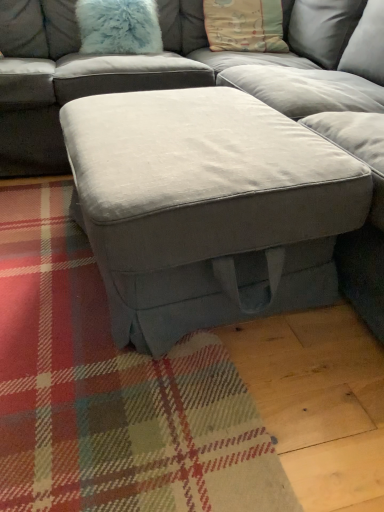
What do you see at coordinates (119, 27) in the screenshot?
I see `fuzzy light blue pillow at upper left, which ranks as the second pillow in right-to-left order` at bounding box center [119, 27].

Describe the element at coordinates (245, 25) in the screenshot. The height and width of the screenshot is (512, 384). I see `pastel cotton pillow at upper center, arranged as the first pillow when viewed from the right` at that location.

Where is `suede gray ottoman at center`? suede gray ottoman at center is located at coordinates (205, 158).

The image size is (384, 512). What are the coordinates of `fuzzy light blue pillow at upper left, which ranks as the second pillow in right-to-left order` in the screenshot? It's located at (119, 27).

Image resolution: width=384 pixels, height=512 pixels. Identify the location of the 2nd pillow directly above the suede gray ottoman at center (from a real-world perspective). (119, 27).

Is fuzzy light blue pillow at upper left, which ranks as the second pillow in right-to-left order, facing towards suede gray ottoman at center?

Yes, fuzzy light blue pillow at upper left, which ranks as the second pillow in right-to-left order, is oriented towards suede gray ottoman at center.

Is fuzzy light blue pillow at upper left, which ranks as the second pillow in right-to-left order, wider than suede gray ottoman at center?

No.

Is pastel cotton pillow at upper center, the second pillow in the left-to-right sequence, aimed at suede gray ottoman at center?

Yes, pastel cotton pillow at upper center, the second pillow in the left-to-right sequence, faces towards suede gray ottoman at center.

Looking at this image, which of these two, pastel cotton pillow at upper center, the second pillow in the left-to-right sequence, or suede gray ottoman at center, is thinner?

Thinner between the two is pastel cotton pillow at upper center, the second pillow in the left-to-right sequence.

Between pastel cotton pillow at upper center, the second pillow in the left-to-right sequence, and suede gray ottoman at center, which one is positioned in front?

Positioned in front is suede gray ottoman at center.

From the image's perspective, which one is positioned lower, pastel cotton pillow at upper center, the second pillow in the left-to-right sequence, or suede gray ottoman at center?

suede gray ottoman at center is shown below in the image.

Is suede gray ottoman at center not inside pastel cotton pillow at upper center, the second pillow in the left-to-right sequence?

suede gray ottoman at center lies outside pastel cotton pillow at upper center, the second pillow in the left-to-right sequence,'s area.

Is suede gray ottoman at center to the left of pastel cotton pillow at upper center, the second pillow in the left-to-right sequence, from the viewer's perspective?

Correct, you'll find suede gray ottoman at center to the left of pastel cotton pillow at upper center, the second pillow in the left-to-right sequence.

Would you say suede gray ottoman at center is a long distance from pastel cotton pillow at upper center, arranged as the first pillow when viewed from the right?

No, suede gray ottoman at center is not far away from pastel cotton pillow at upper center, arranged as the first pillow when viewed from the right.

Are pastel cotton pillow at upper center, arranged as the first pillow when viewed from the right, and fuzzy light blue pillow at upper left, the first pillow viewed from the left, located far from each other?

No, there isn't a large distance between pastel cotton pillow at upper center, arranged as the first pillow when viewed from the right, and fuzzy light blue pillow at upper left, the first pillow viewed from the left.

The image size is (384, 512). What are the coordinates of `pillow behind the fuzzy light blue pillow at upper left, the first pillow viewed from the left` in the screenshot? It's located at (245, 25).

Can you confirm if pastel cotton pillow at upper center, arranged as the first pillow when viewed from the right, is thinner than fuzzy light blue pillow at upper left, which ranks as the second pillow in right-to-left order?

No, pastel cotton pillow at upper center, arranged as the first pillow when viewed from the right, is not thinner than fuzzy light blue pillow at upper left, which ranks as the second pillow in right-to-left order.

Considering the relative sizes of pastel cotton pillow at upper center, the second pillow in the left-to-right sequence, and fuzzy light blue pillow at upper left, which ranks as the second pillow in right-to-left order, in the image provided, is pastel cotton pillow at upper center, the second pillow in the left-to-right sequence, bigger than fuzzy light blue pillow at upper left, which ranks as the second pillow in right-to-left order,?

Correct, pastel cotton pillow at upper center, the second pillow in the left-to-right sequence, is larger in size than fuzzy light blue pillow at upper left, which ranks as the second pillow in right-to-left order.

Which is more to the left, suede gray ottoman at center or fuzzy light blue pillow at upper left, the first pillow viewed from the left?

fuzzy light blue pillow at upper left, the first pillow viewed from the left, is more to the left.

How distant is suede gray ottoman at center from fuzzy light blue pillow at upper left, which ranks as the second pillow in right-to-left order?

The distance of suede gray ottoman at center from fuzzy light blue pillow at upper left, which ranks as the second pillow in right-to-left order, is 30.28 inches.

From a real-world perspective, which is physically below, suede gray ottoman at center or fuzzy light blue pillow at upper left, the first pillow viewed from the left?

suede gray ottoman at center, from a real-world perspective.

From the image's perspective, is suede gray ottoman at center located above or below fuzzy light blue pillow at upper left, the first pillow viewed from the left?

Clearly, from the image's perspective, suede gray ottoman at center is below fuzzy light blue pillow at upper left, the first pillow viewed from the left.

Is fuzzy light blue pillow at upper left, which ranks as the second pillow in right-to-left order, inside or outside of pastel cotton pillow at upper center, arranged as the first pillow when viewed from the right?

fuzzy light blue pillow at upper left, which ranks as the second pillow in right-to-left order, is not inside pastel cotton pillow at upper center, arranged as the first pillow when viewed from the right, it's outside.

Which of these two, fuzzy light blue pillow at upper left, which ranks as the second pillow in right-to-left order, or pastel cotton pillow at upper center, the second pillow in the left-to-right sequence, is smaller?

With smaller size is fuzzy light blue pillow at upper left, which ranks as the second pillow in right-to-left order.

From the image's perspective, relative to pastel cotton pillow at upper center, arranged as the first pillow when viewed from the right, is fuzzy light blue pillow at upper left, the first pillow viewed from the left, above or below?

fuzzy light blue pillow at upper left, the first pillow viewed from the left, is below pastel cotton pillow at upper center, arranged as the first pillow when viewed from the right.

From the image's perspective, starting from the suede gray ottoman at center, which pillow is the 1st one above? Please provide its 2D coordinates.

[(119, 27)]

At what (x,y) coordinates should I click in order to perform the action: click on studio couch that is below the pastel cotton pillow at upper center, arranged as the first pillow when viewed from the right (from the image's perspective). Please return your answer as a coordinate pair (x, y). The height and width of the screenshot is (512, 384). Looking at the image, I should click on (205, 158).

Based on their spatial positions, is fuzzy light blue pillow at upper left, which ranks as the second pillow in right-to-left order, or suede gray ottoman at center closer to pastel cotton pillow at upper center, the second pillow in the left-to-right sequence?

fuzzy light blue pillow at upper left, which ranks as the second pillow in right-to-left order.

Looking at the image, which one is located closer to pastel cotton pillow at upper center, the second pillow in the left-to-right sequence, suede gray ottoman at center or fuzzy light blue pillow at upper left, the first pillow viewed from the left?

fuzzy light blue pillow at upper left, the first pillow viewed from the left.

Estimate the real-world distances between objects in this image. Which object is closer to suede gray ottoman at center, pastel cotton pillow at upper center, arranged as the first pillow when viewed from the right, or fuzzy light blue pillow at upper left, the first pillow viewed from the left?

pastel cotton pillow at upper center, arranged as the first pillow when viewed from the right, is closer to suede gray ottoman at center.

Which object lies nearer to the anchor point fuzzy light blue pillow at upper left, the first pillow viewed from the left, pastel cotton pillow at upper center, the second pillow in the left-to-right sequence, or suede gray ottoman at center?

Among the two, pastel cotton pillow at upper center, the second pillow in the left-to-right sequence, is located nearer to fuzzy light blue pillow at upper left, the first pillow viewed from the left.

Based on the photo, based on their spatial positions, is fuzzy light blue pillow at upper left, which ranks as the second pillow in right-to-left order, or pastel cotton pillow at upper center, the second pillow in the left-to-right sequence, further from suede gray ottoman at center?

The object further to suede gray ottoman at center is fuzzy light blue pillow at upper left, which ranks as the second pillow in right-to-left order.

Considering their positions, is suede gray ottoman at center positioned further to fuzzy light blue pillow at upper left, the first pillow viewed from the left, than pastel cotton pillow at upper center, the second pillow in the left-to-right sequence?

Among the two, suede gray ottoman at center is located further to fuzzy light blue pillow at upper left, the first pillow viewed from the left.

You are a GUI agent. You are given a task and a screenshot of the screen. Output one action in this format:
    pyautogui.click(x=<x>, y=<y>)
    Task: Click on the pillow positioned between suede gray ottoman at center and pastel cotton pillow at upper center, arranged as the first pillow when viewed from the right, from near to far
    This screenshot has width=384, height=512.
    Given the screenshot: What is the action you would take?
    pyautogui.click(x=119, y=27)